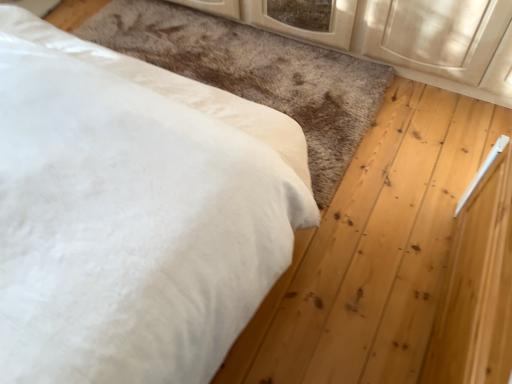
Find the location of a particular element. This screenshot has height=384, width=512. white soft rug at lower left is located at coordinates (256, 73).

This screenshot has width=512, height=384. Describe the element at coordinates (256, 73) in the screenshot. I see `white soft rug at lower left` at that location.

What do you see at coordinates (133, 213) in the screenshot? Image resolution: width=512 pixels, height=384 pixels. I see `white soft bed at upper left` at bounding box center [133, 213].

Where is `white soft bed at upper left`? This screenshot has height=384, width=512. white soft bed at upper left is located at coordinates (133, 213).

Where is `white soft rug at lower left`? Image resolution: width=512 pixels, height=384 pixels. white soft rug at lower left is located at coordinates (256, 73).

Looking at this image, considering the relative positions of white soft bed at upper left and white soft rug at lower left in the image provided, is white soft bed at upper left to the left or to the right of white soft rug at lower left?

white soft bed at upper left is to the left of white soft rug at lower left.

Is the depth of white soft bed at upper left greater than that of white soft rug at lower left?

No, it is not.

Is point (29, 318) positioned in front of point (113, 22)?

That is True.

From the picture: From the image's perspective, which one is positioned lower, white soft bed at upper left or white soft rug at lower left?

white soft bed at upper left appears lower in the image.

From a real-world perspective, which is physically above, white soft bed at upper left or white soft rug at lower left?

From a 3D spatial view, white soft bed at upper left is above.

Considering the relative sizes of white soft bed at upper left and white soft rug at lower left in the image provided, is white soft bed at upper left wider than white soft rug at lower left?

Incorrect, the width of white soft bed at upper left does not surpass that of white soft rug at lower left.

Does white soft bed at upper left have a lesser height compared to white soft rug at lower left?

In fact, white soft bed at upper left may be taller than white soft rug at lower left.

Considering the sizes of objects white soft bed at upper left and white soft rug at lower left in the image provided, who is bigger, white soft bed at upper left or white soft rug at lower left?

white soft bed at upper left.

Would you say white soft rug at lower left is part of white soft bed at upper left's contents?

Definitely not — white soft rug at lower left is not inside white soft bed at upper left.

Based on the photo, are white soft bed at upper left and white soft rug at lower left far apart?

They are positioned close to each other.

Is white soft bed at upper left facing away from white soft rug at lower left?

That's not correct — white soft bed at upper left is not looking away from white soft rug at lower left.

Can you tell me how much white soft bed at upper left and white soft rug at lower left differ in facing direction?

The angular difference between white soft bed at upper left and white soft rug at lower left is 92.1 degrees.

Find the location of a particular element. The height and width of the screenshot is (384, 512). bed below the white soft rug at lower left (from the image's perspective) is located at coordinates (133, 213).

Considering the positions of objects white soft rug at lower left and white soft bed at upper left in the image provided, who is more to the right, white soft rug at lower left or white soft bed at upper left?

white soft rug at lower left.

Considering the positions of objects white soft rug at lower left and white soft bed at upper left in the image provided, who is behind, white soft rug at lower left or white soft bed at upper left?

white soft rug at lower left is further from the camera.

Between point (316, 184) and point (261, 176), which one is positioned in front?

The point (261, 176) is more forward.

From the image's perspective, is white soft rug at lower left below white soft bed at upper left?

No.

From the picture: From a real-world perspective, is white soft rug at lower left above or below white soft bed at upper left?

white soft rug at lower left is situated lower than white soft bed at upper left in the real world.

Between white soft rug at lower left and white soft bed at upper left, which one has smaller width?

Thinner between the two is white soft bed at upper left.

Can you confirm if white soft rug at lower left is taller than white soft bed at upper left?

Incorrect, the height of white soft rug at lower left is not larger of that of white soft bed at upper left.

Who is bigger, white soft rug at lower left or white soft bed at upper left?

Bigger between the two is white soft bed at upper left.

Is white soft bed at upper left located within white soft rug at lower left?

Actually, white soft bed at upper left is outside white soft rug at lower left.

Is white soft rug at lower left beside white soft bed at upper left?

No, white soft rug at lower left is not beside white soft bed at upper left.

Is white soft rug at lower left looking in the opposite direction of white soft bed at upper left?

No, white soft rug at lower left is not facing the opposite direction of white soft bed at upper left.

How different are the orientations of white soft rug at lower left and white soft bed at upper left in degrees?

The angle between the facing direction of white soft rug at lower left and the facing direction of white soft bed at upper left is 92.1 degrees.

You are a GUI agent. You are given a task and a screenshot of the screen. Output one action in this format:
    pyautogui.click(x=<x>, y=<y>)
    Task: Click on the bed lying below the white soft rug at lower left (from the image's perspective)
    This screenshot has height=384, width=512.
    Given the screenshot: What is the action you would take?
    point(133,213)

In the image, there is a white soft rug at lower left. At what (x,y) coordinates should I click in order to perform the action: click on bed below it (from the image's perspective). Please return your answer as a coordinate pair (x, y). Looking at the image, I should click on (133, 213).

What are the coordinates of `bed in front of the white soft rug at lower left` in the screenshot? It's located at (133, 213).